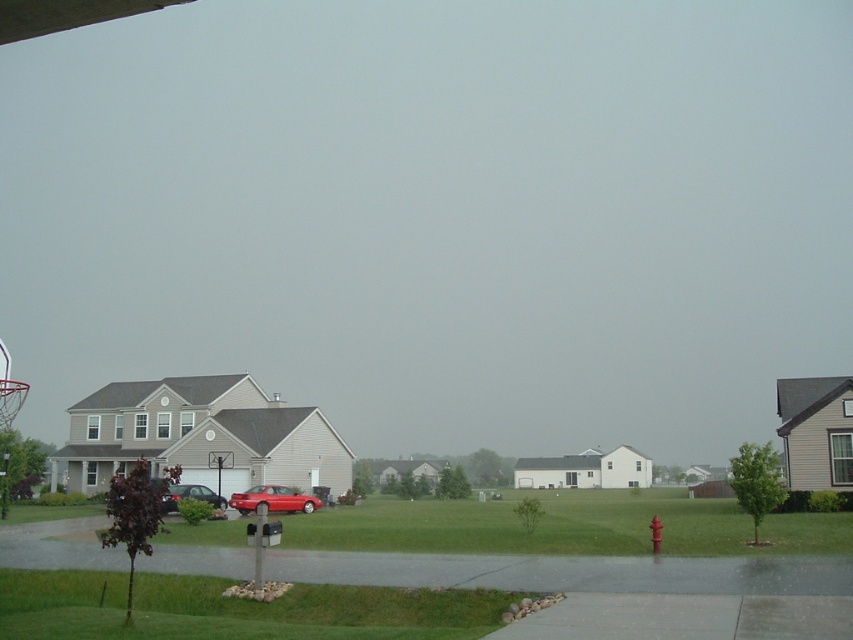
Between point (161, 506) and point (219, 497), which one is positioned behind?

Positioned behind is point (219, 497).

Can you confirm if metallic red sedan at center-left is thinner than metallic silver basketball hoop at center?

Incorrect, metallic red sedan at center-left's width is not less than metallic silver basketball hoop at center's.

Describe the element at coordinates (190, 497) in the screenshot. I see `metallic red sedan at center-left` at that location.

This screenshot has height=640, width=853. Identify the location of metallic red sedan at center-left. tap(190, 497).

Is glossy red car at center below metallic silver basketball hoop at center?

Yes.

Can you confirm if glossy red car at center is smaller than metallic silver basketball hoop at center?

No, glossy red car at center is not smaller than metallic silver basketball hoop at center.

Who is more forward, [276,484] or [219,468]?

Point [219,468] is in front.

Where is `glossy red car at center`? The height and width of the screenshot is (640, 853). glossy red car at center is located at coordinates (273, 499).

Does metallic silver basketball hoop at center appear under red plastic fire hydrant at center?

Correct, metallic silver basketball hoop at center is located below red plastic fire hydrant at center.

Where is `metallic silver basketball hoop at center`? metallic silver basketball hoop at center is located at coordinates (219, 465).